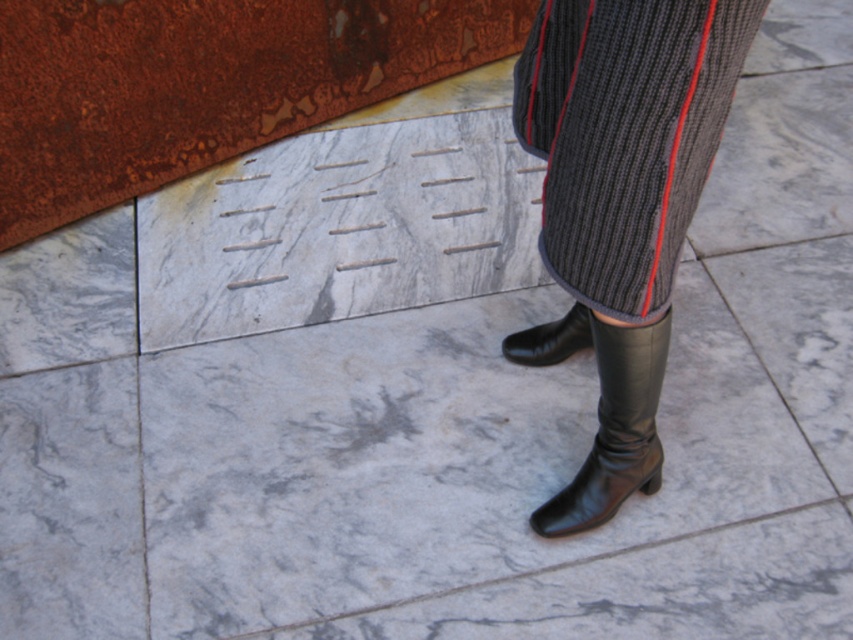
Does ribbed wool pants at center have a greater height compared to black leather boot at lower center?

Yes.

Is point (699, 104) farther from camera compared to point (554, 323)?

No.

Is point (634, 163) farther from camera compared to point (560, 333)?

No, it is not.

The image size is (853, 640). Find the location of `ribbed wool pants at center`. ribbed wool pants at center is located at coordinates [x=625, y=134].

Between point (662, 68) and point (607, 420), which one is positioned behind?

Point (607, 420)

Can you confirm if ribbed wool pants at center is thinner than black leather boot at lower right?

No, ribbed wool pants at center is not thinner than black leather boot at lower right.

The image size is (853, 640). What are the coordinates of `ribbed wool pants at center` in the screenshot? It's located at (625, 134).

The height and width of the screenshot is (640, 853). Describe the element at coordinates (608, 417) in the screenshot. I see `black leather boot at lower right` at that location.

Who is positioned more to the left, black leather boot at lower right or black leather boot at lower center?

black leather boot at lower center

This screenshot has width=853, height=640. What do you see at coordinates (608, 417) in the screenshot? I see `black leather boot at lower right` at bounding box center [608, 417].

Image resolution: width=853 pixels, height=640 pixels. I want to click on black leather boot at lower right, so click(x=608, y=417).